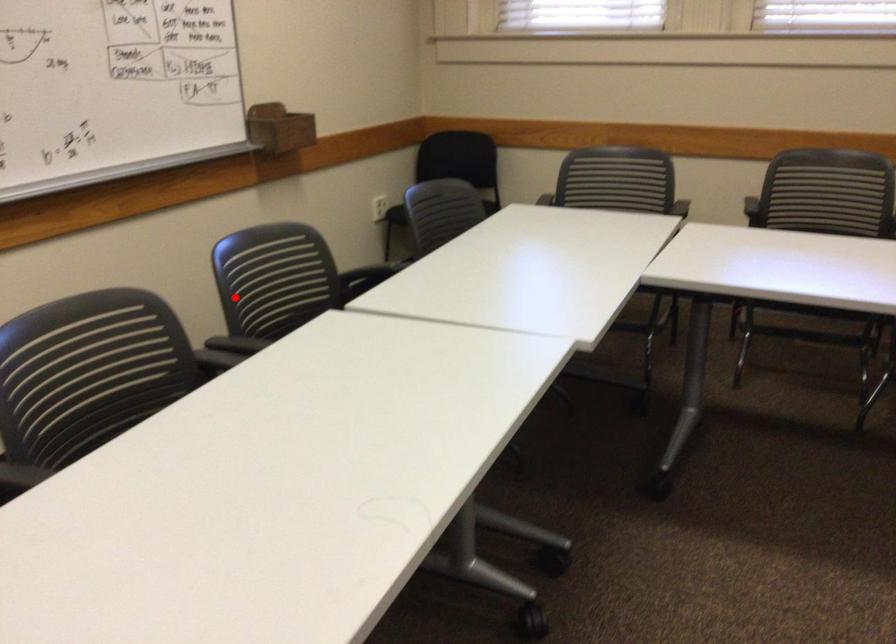
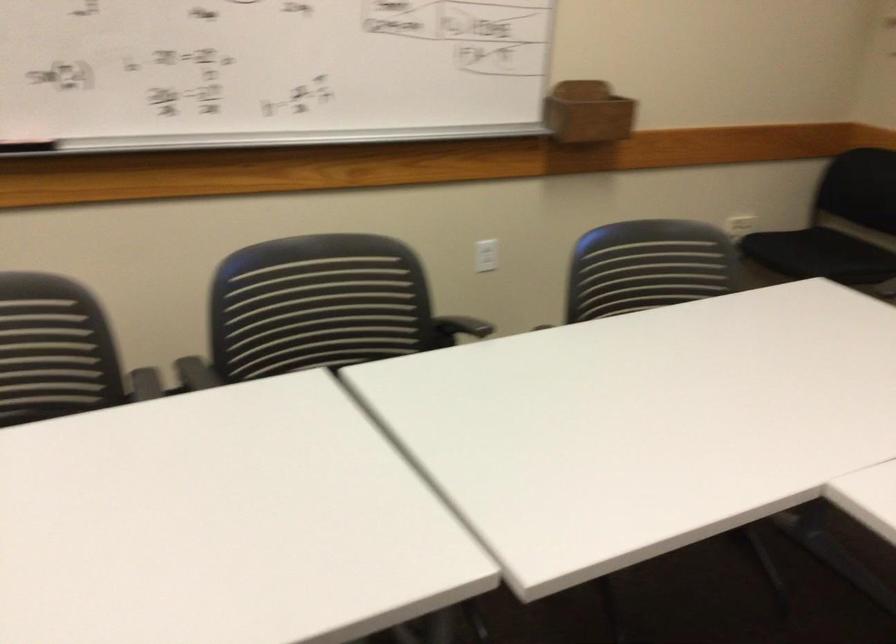
Question: I am providing you with two images of the same scene from different viewpoints. A red point is shown in image1. For the corresponding object point in image2, is it positioned nearer or farther from the camera?

Choices:
 (A) Nearer
 (B) Farther

Answer: (A)